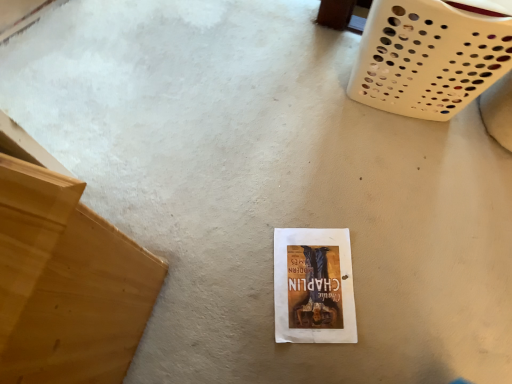
Where is `vacant space in front of white plastic basket at upper right`? This screenshot has width=512, height=384. vacant space in front of white plastic basket at upper right is located at coordinates coord(395,174).